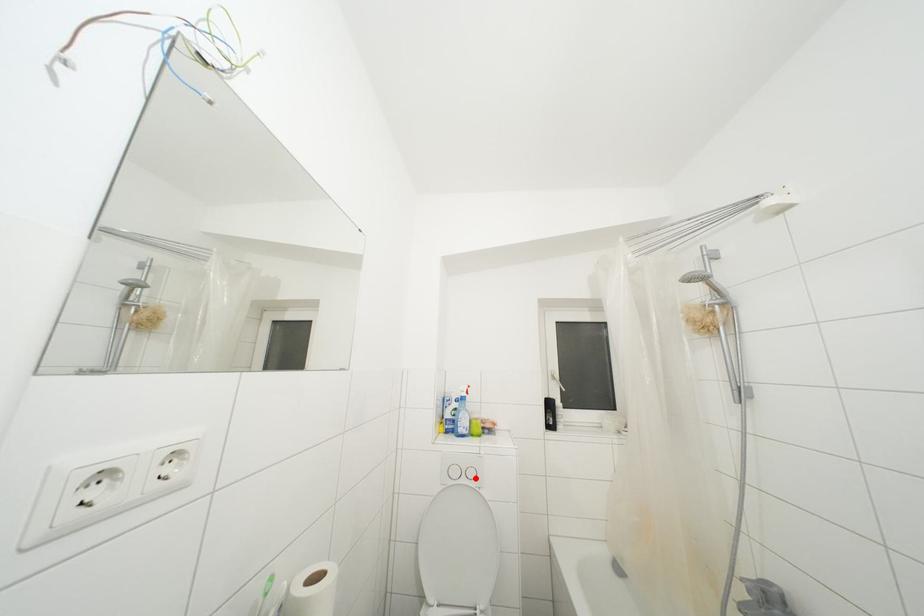
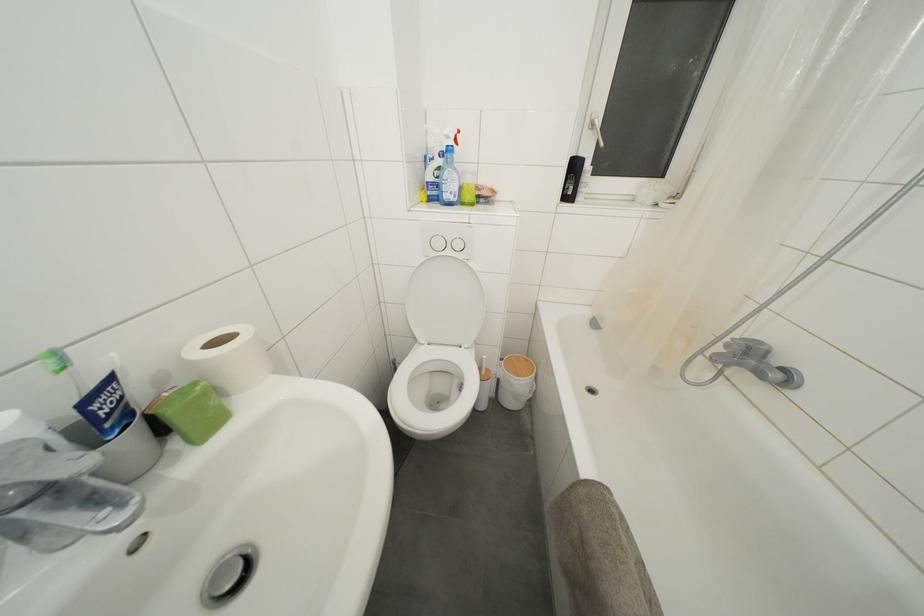
The point at the highlighted location is marked in the first image. Where is the corresponding point in the second image?

(463, 251)